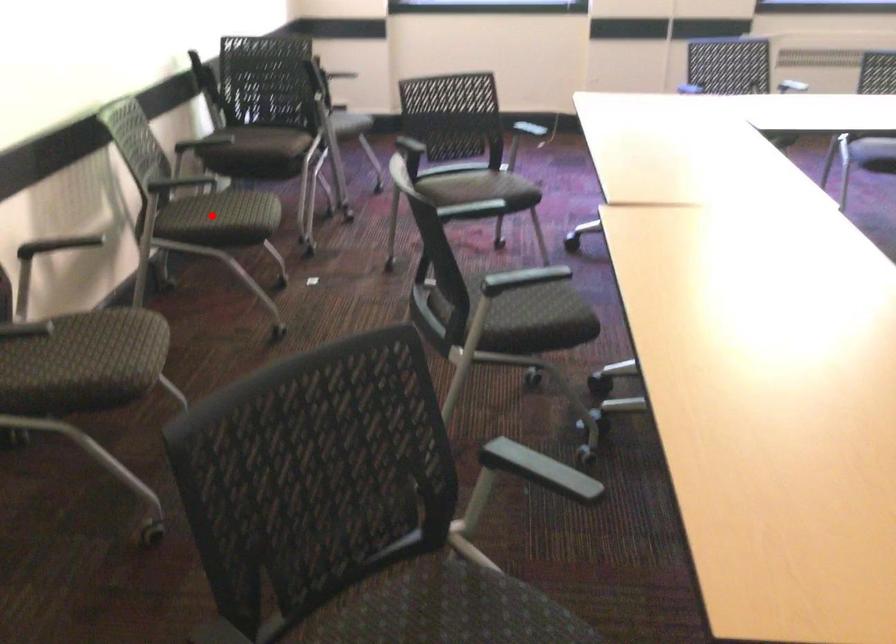
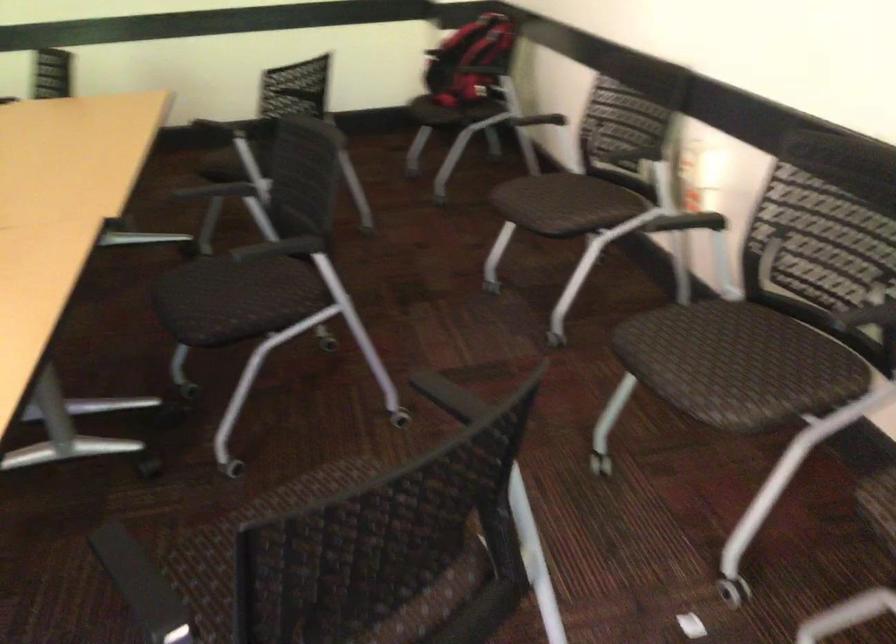
Find the pixel in the second image that matches the highlighted location in the first image.

(735, 335)